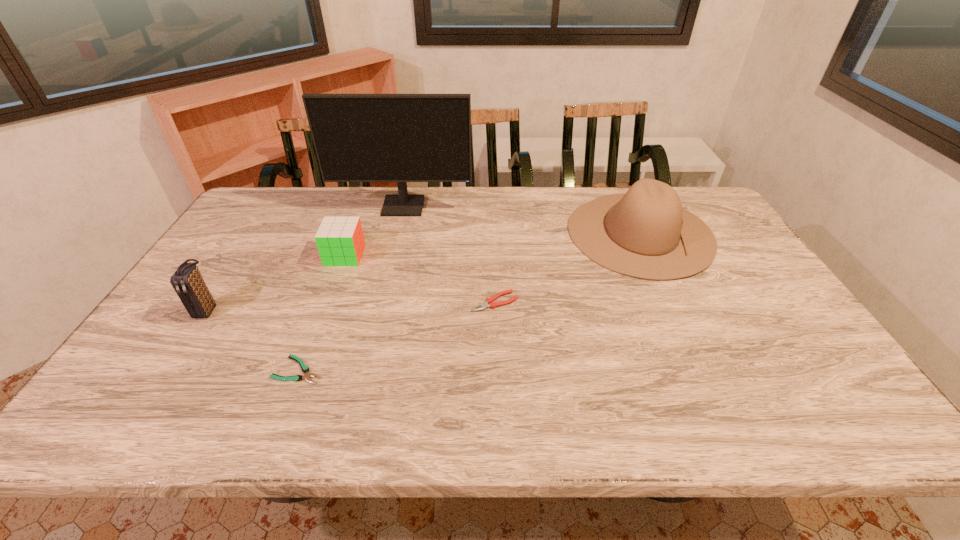
Find the location of a particular element. The height and width of the screenshot is (540, 960). vacant space located 0.310m on the front of the rightmost object is located at coordinates (704, 369).

This screenshot has width=960, height=540. In order to click on vacant area located 0.270m with the zip open on the third tallest object in this screenshot , I will do `click(137, 417)`.

Find the location of `vacant space located on the right of the third shortest object`. vacant space located on the right of the third shortest object is located at coordinates (392, 255).

Locate an element on the screen. The height and width of the screenshot is (540, 960). free region located 0.130m on the front of the right pliers is located at coordinates (497, 351).

Locate an element on the screen. vacant area situated on the left of the nearest object is located at coordinates (157, 370).

What are the coordinates of `computer monitor at the far edge` in the screenshot? It's located at (401, 138).

Identify the location of sombrero positioned at the far edge. (645, 233).

I want to click on object at the left edge, so click(x=187, y=281).

This screenshot has height=540, width=960. Identify the location of object that is at the right edge. (645, 233).

Image resolution: width=960 pixels, height=540 pixels. I want to click on object located at the far right corner, so click(x=645, y=233).